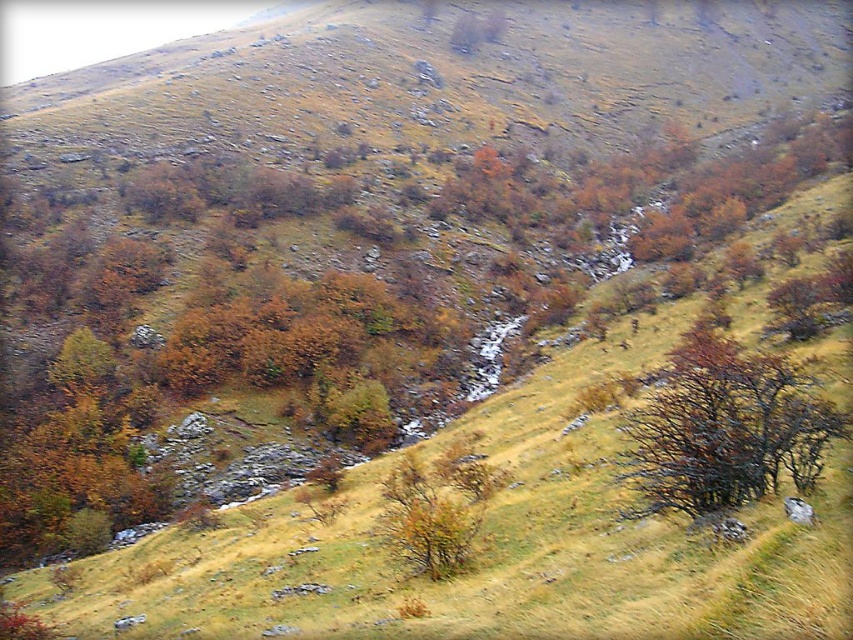
You are standing at the point marked as point (724, 429) in the image. What object is exactly at that point?

The brown matte tree at center right is exactly at point (724, 429).